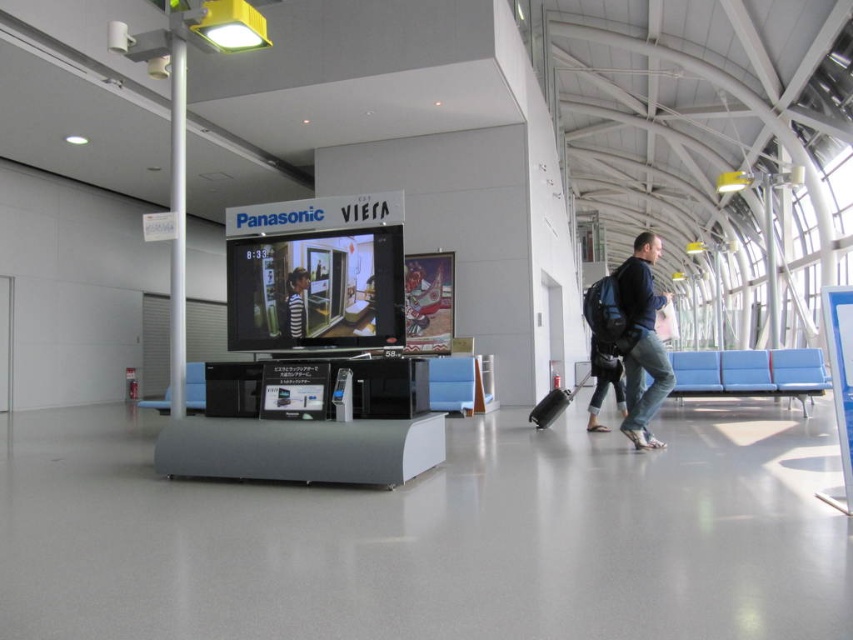
Question: Is the position of striped fabric shirt at center more distant than that of black matte suitcase at center?

Choices:
 (A) no
 (B) yes

Answer: (A)

Question: Which of the following is the closest to the observer?

Choices:
 (A) black matte suitcase at center
 (B) dark blue jeans at right

Answer: (B)

Question: Is dark blue jeans at right closer to the viewer compared to striped fabric shirt at center?

Choices:
 (A) yes
 (B) no

Answer: (B)

Question: Among these objects, which one is farthest from the camera?

Choices:
 (A) black matte suitcase at center
 (B) striped fabric shirt at center

Answer: (A)

Question: Which point is farther to the camera?

Choices:
 (A) striped fabric shirt at center
 (B) dark blue jeans at right
 (C) black matte suitcase at center

Answer: (C)

Question: Does dark blue jeans at right have a smaller size compared to black matte suitcase at center?

Choices:
 (A) yes
 (B) no

Answer: (A)